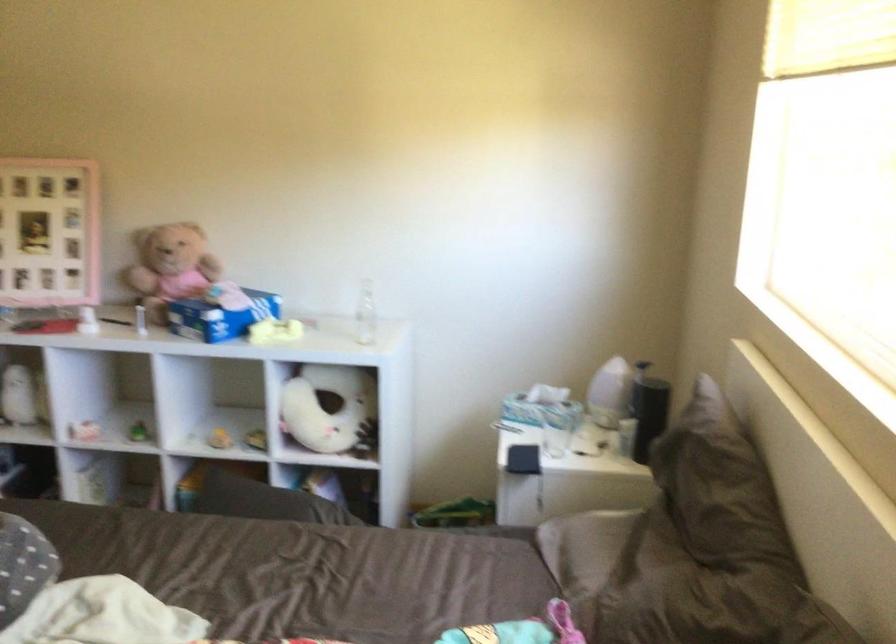
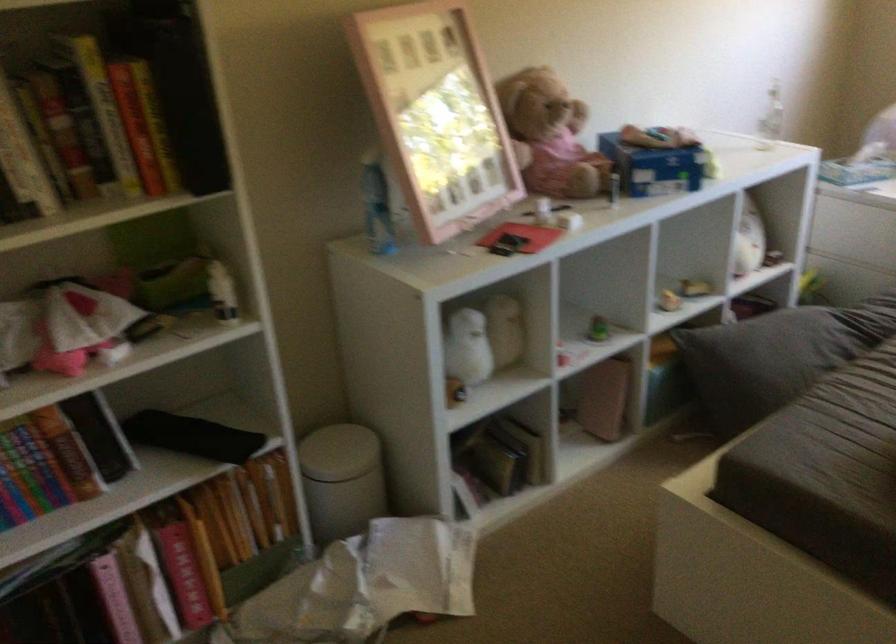
Where in the second image is the point corresponding to pixel 174 313 from the first image?

(655, 166)